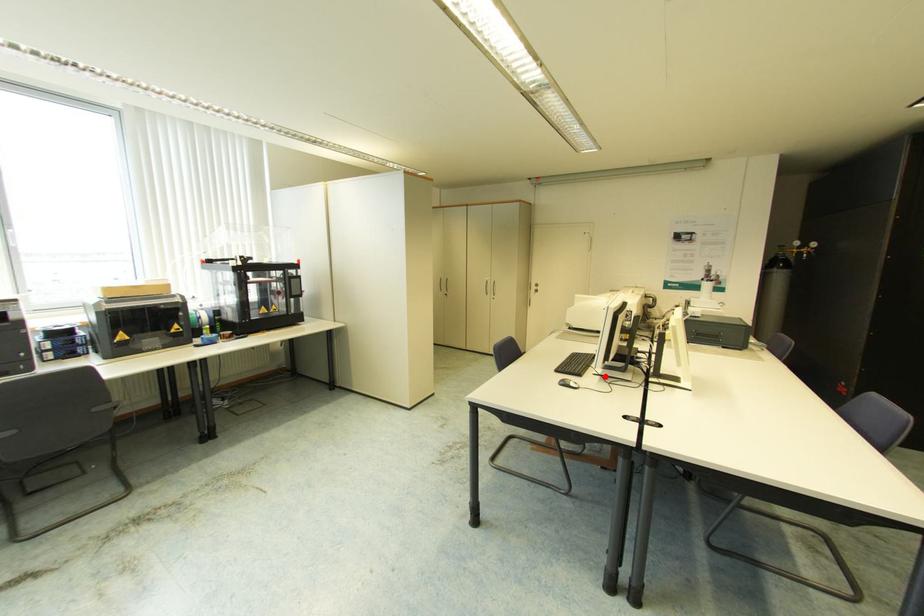
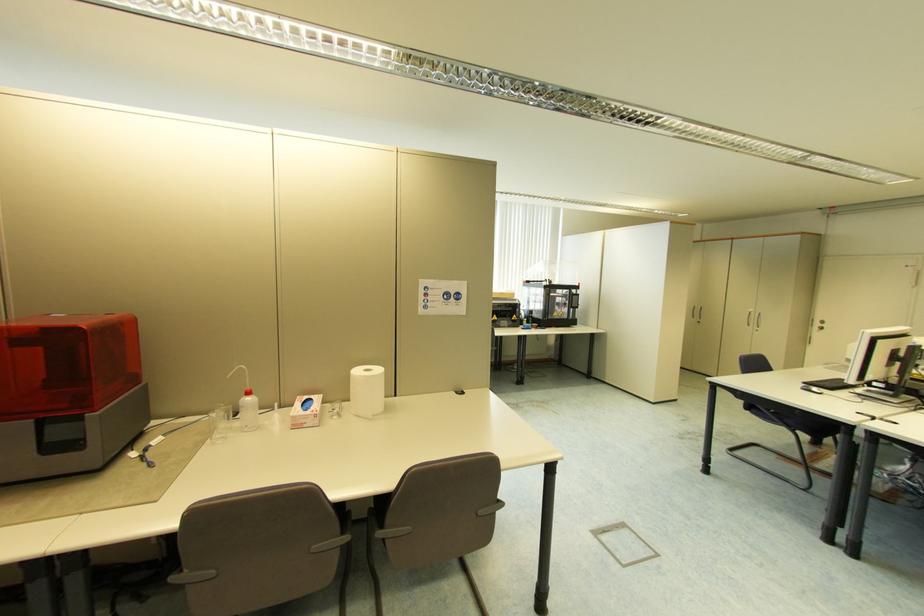
Where in the second image is the point corresponding to the highlighted location from the first image?

(862, 394)